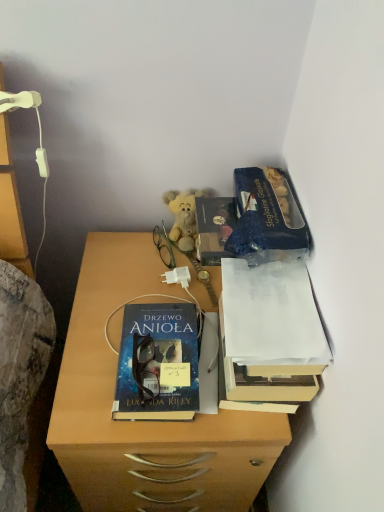
Where is `vacant area situated to the left side of blue glossy book at center, which is counted as the 2th book, starting from the right`? The image size is (384, 512). vacant area situated to the left side of blue glossy book at center, which is counted as the 2th book, starting from the right is located at coordinates (89, 361).